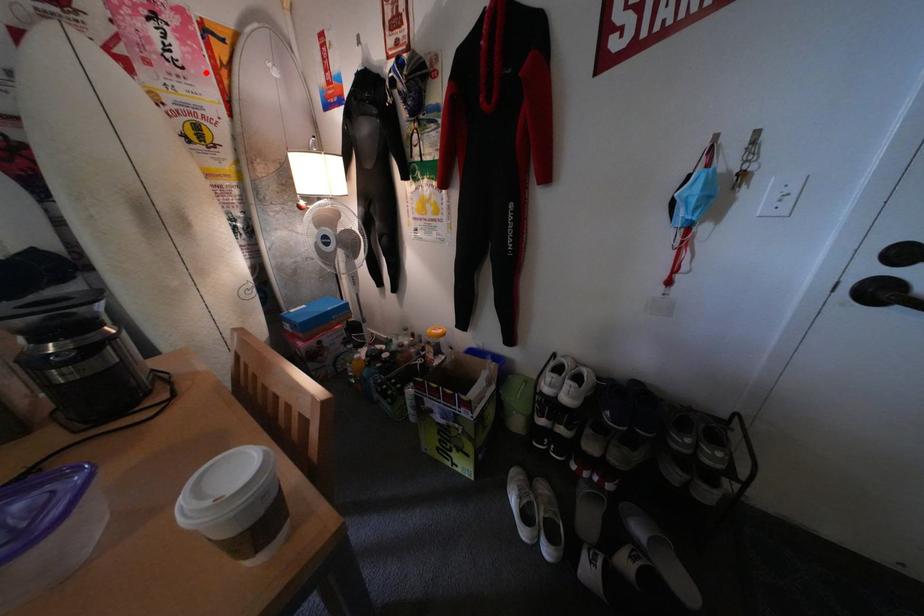
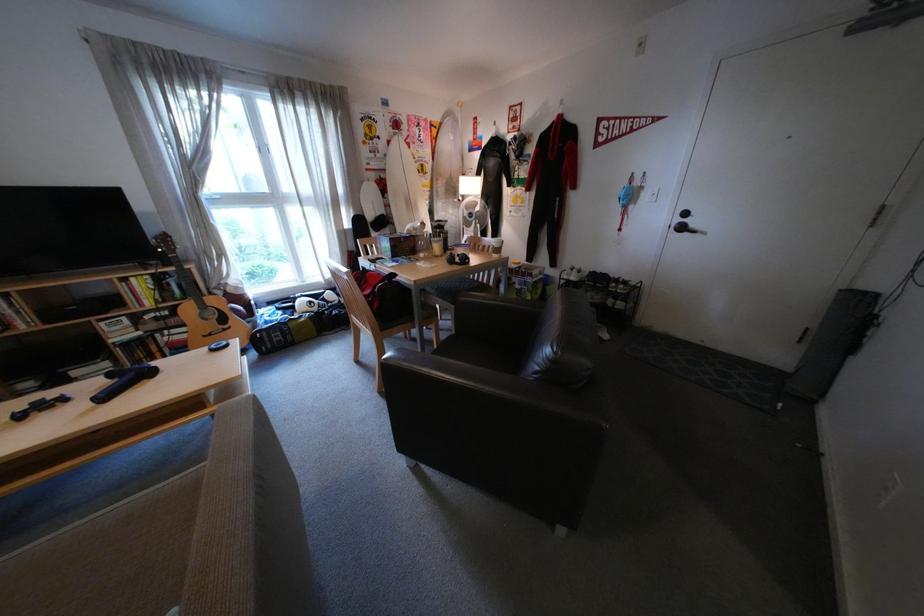
Question: I am providing you with two images of the same scene from different viewpoints. Given a red point in image1, look at the same physical point in image2. Is it:

Choices:
 (A) Closer to the viewpoint
 (B) Farther from the viewpoint

Answer: (A)